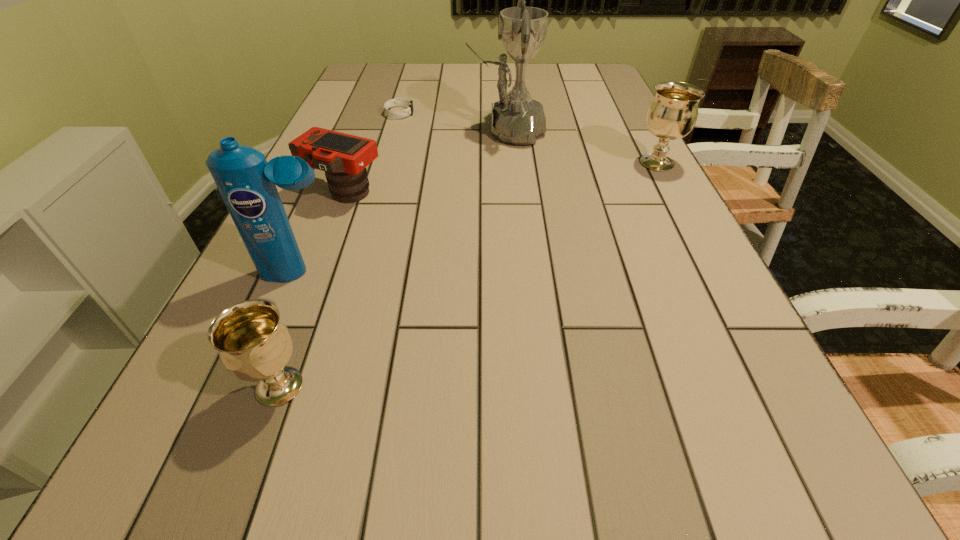
The width and height of the screenshot is (960, 540). I want to click on wristband that is at the left edge, so click(x=398, y=101).

You are a GUI agent. You are given a task and a screenshot of the screen. Output one action in this format:
    pyautogui.click(x=<x>, y=<y>)
    Task: Click on the shampoo at the left edge
    This screenshot has height=540, width=960.
    Given the screenshot: What is the action you would take?
    pyautogui.click(x=247, y=183)

Locate an element on the screen. Image resolution: width=960 pixels, height=540 pixels. object that is at the right edge is located at coordinates (672, 114).

Locate an element on the screen. object positioned at the near left corner is located at coordinates (254, 344).

I want to click on free space at the far edge of the desktop, so click(429, 89).

You are a GUI agent. You are given a task and a screenshot of the screen. Output one action in this format:
    pyautogui.click(x=<x>, y=<y>)
    Task: Click on the vacant space at the near edge
    The width and height of the screenshot is (960, 540).
    Given the screenshot: What is the action you would take?
    pyautogui.click(x=434, y=411)

Locate an element on the screen. Image resolution: width=960 pixels, height=540 pixels. free space at the left edge is located at coordinates (367, 115).

Where is `vacant space at the right edge of the desktop`? This screenshot has height=540, width=960. vacant space at the right edge of the desktop is located at coordinates (603, 150).

The height and width of the screenshot is (540, 960). I want to click on free area in between the second nearest object and the farther chalice, so pyautogui.click(x=479, y=218).

Identify the location of empty location between the farther chalice and the shampoo. (479, 218).